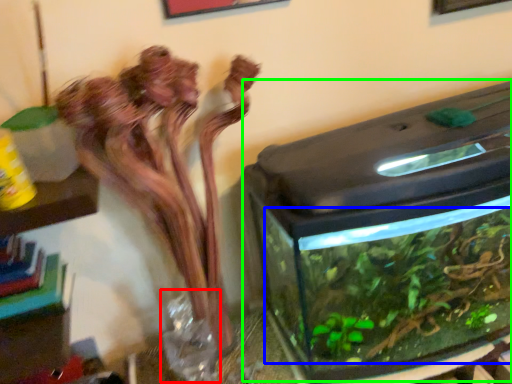
Question: Which is nearer to the glass vase (highlighted by a red box)? plant (highlighted by a blue box) or water tank (highlighted by a green box).

Choices:
 (A) plant
 (B) water tank

Answer: (A)